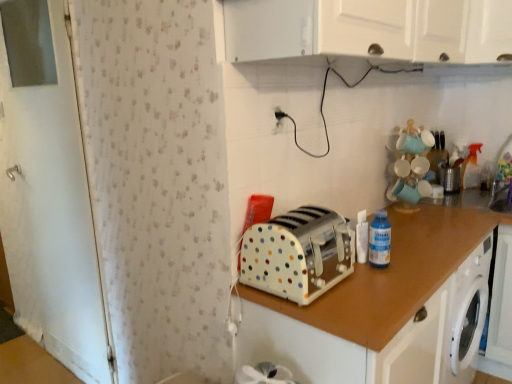
Locate an element on the screen. vacant area that lies in front of white polka dot plastic toaster at center is located at coordinates (346, 311).